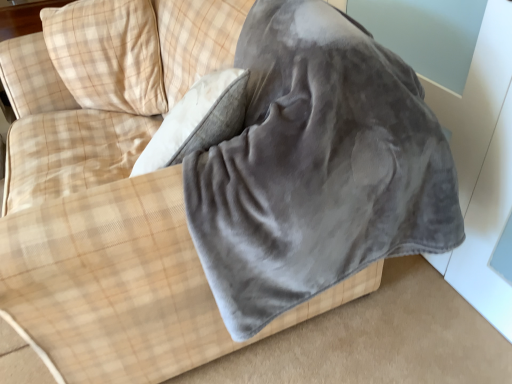
Question: From a real-world perspective, is gray fleece blanket at center under beige plaid pillow at upper left?

Choices:
 (A) no
 (B) yes

Answer: (B)

Question: Is gray fleece blanket at center taller than beige plaid pillow at upper left?

Choices:
 (A) no
 (B) yes

Answer: (B)

Question: Is gray fleece blanket at center aimed at beige plaid pillow at upper left?

Choices:
 (A) yes
 (B) no

Answer: (B)

Question: From the image's perspective, would you say gray fleece blanket at center is shown under beige plaid pillow at upper left?

Choices:
 (A) no
 (B) yes

Answer: (B)

Question: Does gray fleece blanket at center appear on the left side of beige plaid pillow at upper left?

Choices:
 (A) yes
 (B) no

Answer: (B)

Question: Considering the relative sizes of gray fleece blanket at center and beige plaid pillow at upper left in the image provided, is gray fleece blanket at center bigger than beige plaid pillow at upper left?

Choices:
 (A) no
 (B) yes

Answer: (B)

Question: Is beige plaid pillow at upper left smaller than gray fleece blanket at center?

Choices:
 (A) no
 (B) yes

Answer: (B)

Question: Is beige plaid pillow at upper left not close to gray fleece blanket at center?

Choices:
 (A) no
 (B) yes

Answer: (A)

Question: From a real-world perspective, is beige plaid pillow at upper left on top of gray fleece blanket at center?

Choices:
 (A) yes
 (B) no

Answer: (A)

Question: Could you tell me if beige plaid pillow at upper left is facing gray fleece blanket at center?

Choices:
 (A) yes
 (B) no

Answer: (B)

Question: Does beige plaid pillow at upper left have a lesser height compared to gray fleece blanket at center?

Choices:
 (A) no
 (B) yes

Answer: (B)

Question: Does beige plaid pillow at upper left have a greater width compared to gray fleece blanket at center?

Choices:
 (A) no
 (B) yes

Answer: (A)

Question: From a real-world perspective, is beige plaid pillow at upper left physically located above or below gray fleece blanket at center?

Choices:
 (A) above
 (B) below

Answer: (A)